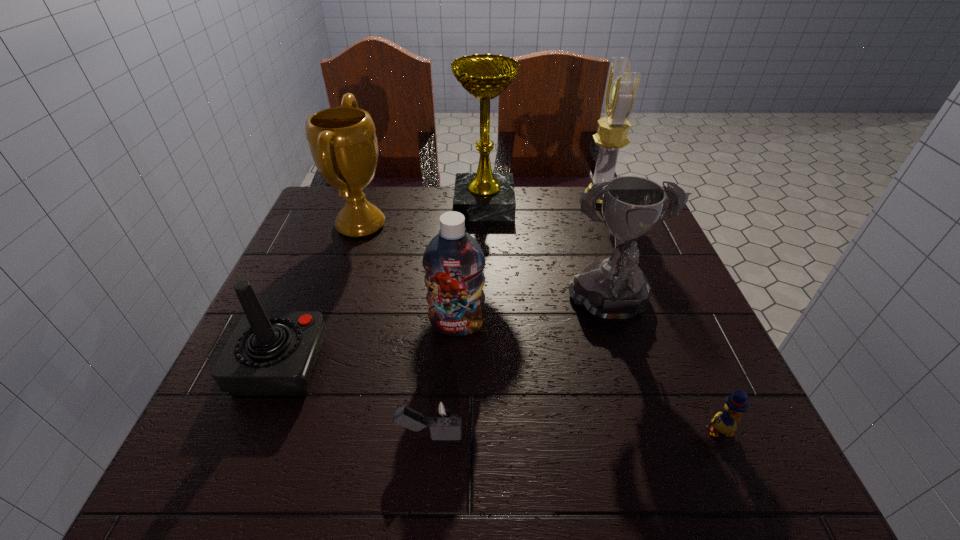
Locate an element on the screen. object situated at the far left corner is located at coordinates (342, 140).

You are a GUI agent. You are given a task and a screenshot of the screen. Output one action in this format:
    pyautogui.click(x=<x>, y=<y>)
    Task: Click on the object situated at the far right corner
    The width and height of the screenshot is (960, 540).
    Given the screenshot: What is the action you would take?
    pyautogui.click(x=622, y=86)

This screenshot has width=960, height=540. In order to click on object at the near right corner in this screenshot , I will do `click(725, 423)`.

Where is `vacant region at the far edge of the desktop`? The image size is (960, 540). vacant region at the far edge of the desktop is located at coordinates (381, 189).

Locate an element on the screen. This screenshot has height=540, width=960. free space at the left edge of the desktop is located at coordinates (245, 409).

Find the location of a particular element. Image resolution: width=960 pixels, height=540 pixels. vacant space at the right edge of the desktop is located at coordinates pos(649,345).

In the image, there is a desktop. Find the location of `vacant space at the near right corner`. vacant space at the near right corner is located at coordinates (714, 457).

Find the location of a particular element. vacant area that lies between the leftmost award and the third award from right to left is located at coordinates (422, 214).

Locate an element on the screen. free space that is in between the duckling and the shampoo is located at coordinates (588, 378).

The image size is (960, 540). Identify the location of free space that is in between the sixth tallest object and the shampoo. (369, 345).